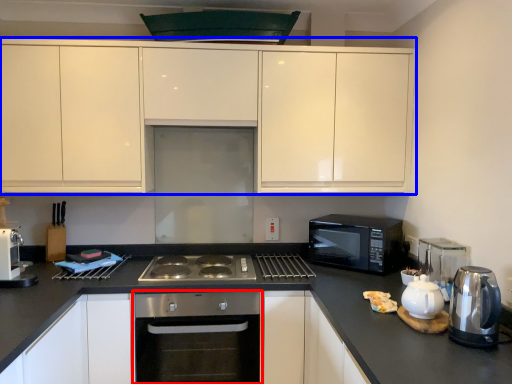
Question: Which object is further to the camera taking this photo, oven (highlighted by a red box) or cabinetry (highlighted by a blue box)?

Choices:
 (A) oven
 (B) cabinetry

Answer: (B)